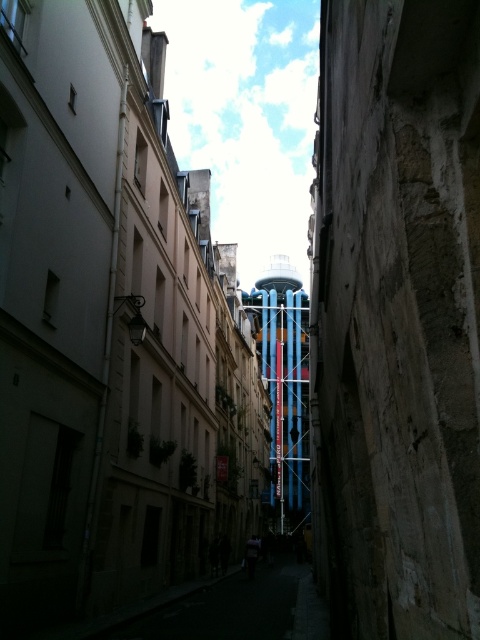
Between weathered stone wall at center and blue metallic scaffolding at center, which one appears on the left side from the viewer's perspective?

blue metallic scaffolding at center

Does weathered stone wall at center have a smaller size compared to blue metallic scaffolding at center?

Yes, weathered stone wall at center is smaller than blue metallic scaffolding at center.

The image size is (480, 640). Describe the element at coordinates (396, 317) in the screenshot. I see `weathered stone wall at center` at that location.

You are a GUI agent. You are given a task and a screenshot of the screen. Output one action in this format:
    pyautogui.click(x=<x>, y=<y>)
    Task: Click on the weathered stone wall at center
    This screenshot has height=640, width=480.
    Given the screenshot: What is the action you would take?
    pyautogui.click(x=396, y=317)